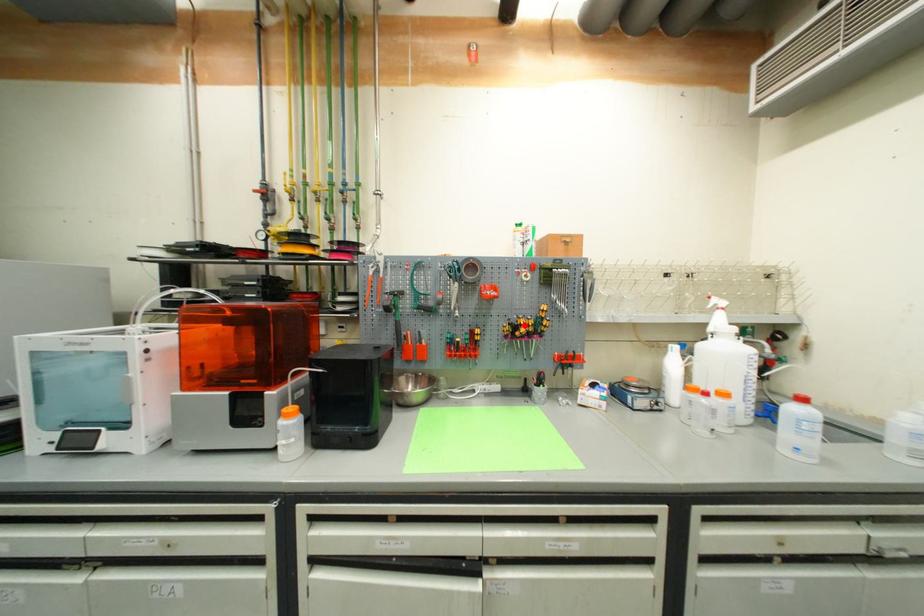
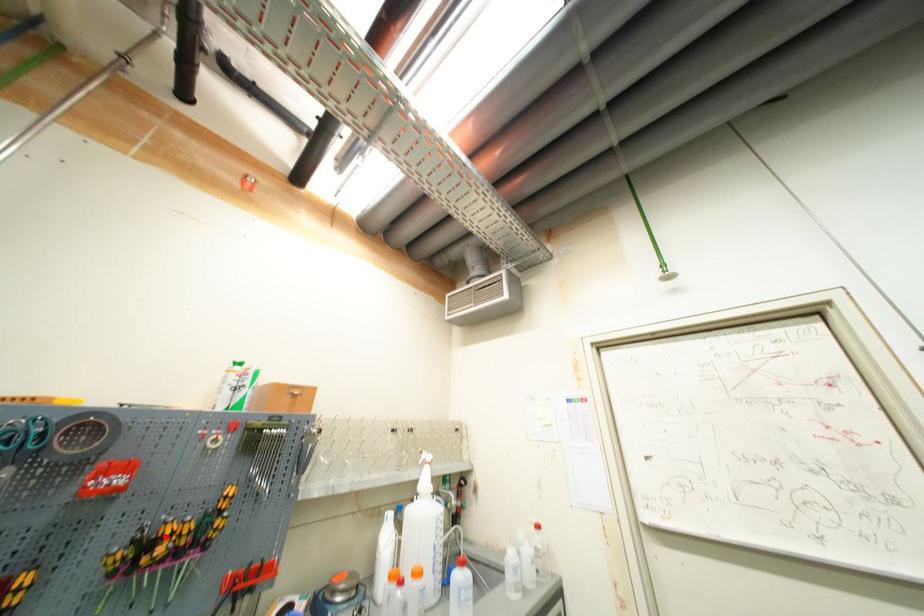
I am providing you with two images of the same scene from different viewpoints. A red point is marked on the first image and another point is marked on the second image. Are the points marked in image1 and image2 representing the same 3D position?

Yes